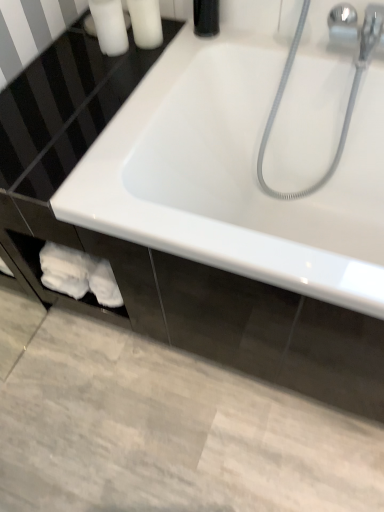
Question: From the image's perspective, is white matte soap at upper left, arranged as the 2th toiletry when viewed from the right, on top of white matte bottle at upper left, placed as the first toiletry when sorted from right to left?

Choices:
 (A) yes
 (B) no

Answer: (B)

Question: Is white matte soap at upper left, which ranks as the first toiletry in left-to-right order, turned away from white matte bottle at upper left, placed as the first toiletry when sorted from right to left?

Choices:
 (A) yes
 (B) no

Answer: (B)

Question: Is white matte soap at upper left, arranged as the 2th toiletry when viewed from the right, next to white matte bottle at upper left, placed as the first toiletry when sorted from right to left, and touching it?

Choices:
 (A) yes
 (B) no

Answer: (A)

Question: Is white matte soap at upper left, arranged as the 2th toiletry when viewed from the right, closer to camera compared to white matte bottle at upper left, placed as the first toiletry when sorted from right to left?

Choices:
 (A) no
 (B) yes

Answer: (B)

Question: Can you confirm if white matte soap at upper left, arranged as the 2th toiletry when viewed from the right, is positioned to the left of white matte bottle at upper left, arranged as the 2th toiletry when viewed from the left?

Choices:
 (A) yes
 (B) no

Answer: (A)

Question: Considering the relative positions of white matte soap at upper left, arranged as the 2th toiletry when viewed from the right, and white matte bottle at upper left, arranged as the 2th toiletry when viewed from the left, in the image provided, is white matte soap at upper left, arranged as the 2th toiletry when viewed from the right, behind white matte bottle at upper left, arranged as the 2th toiletry when viewed from the left,?

Choices:
 (A) yes
 (B) no

Answer: (B)

Question: Is the position of white glossy bathtub at center more distant than that of white matte bottle at upper left, placed as the first toiletry when sorted from right to left?

Choices:
 (A) yes
 (B) no

Answer: (B)

Question: Is the position of white glossy bathtub at center less distant than that of white matte bottle at upper left, placed as the first toiletry when sorted from right to left?

Choices:
 (A) yes
 (B) no

Answer: (A)

Question: Does white glossy bathtub at center appear on the left side of white matte bottle at upper left, placed as the first toiletry when sorted from right to left?

Choices:
 (A) no
 (B) yes

Answer: (A)

Question: Is white glossy bathtub at center with white matte bottle at upper left, placed as the first toiletry when sorted from right to left?

Choices:
 (A) no
 (B) yes

Answer: (A)

Question: Considering the relative sizes of white glossy bathtub at center and white matte bottle at upper left, placed as the first toiletry when sorted from right to left, in the image provided, is white glossy bathtub at center taller than white matte bottle at upper left, placed as the first toiletry when sorted from right to left,?

Choices:
 (A) no
 (B) yes

Answer: (B)

Question: Is white glossy bathtub at center wider than white matte bottle at upper left, placed as the first toiletry when sorted from right to left?

Choices:
 (A) yes
 (B) no

Answer: (A)

Question: Considering the relative positions of white matte bottle at upper left, arranged as the 2th toiletry when viewed from the left, and white matte soap at upper left, which ranks as the first toiletry in left-to-right order, in the image provided, is white matte bottle at upper left, arranged as the 2th toiletry when viewed from the left, in front of white matte soap at upper left, which ranks as the first toiletry in left-to-right order,?

Choices:
 (A) yes
 (B) no

Answer: (B)